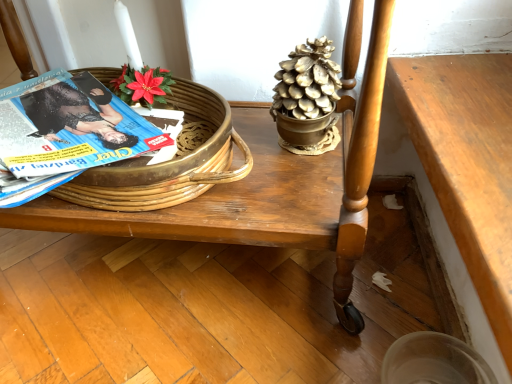
In order to face blue glossy magazine at left, should I rotate leftwards or rightwards?

Rotate left and turn 25.977 degrees.

This screenshot has height=384, width=512. Identify the location of woven wood basket at upper left. click(x=169, y=161).

Identify the location of gold metallic pinecone at upper center. (307, 97).

Is wooden table at center wider than gold metallic pinecone at upper center?

Yes, wooden table at center is wider than gold metallic pinecone at upper center.

Which is less distant, [349,262] or [325,45]?

Point [349,262] is closer to the camera than point [325,45].

Considering the sizes of wooden table at center and gold metallic pinecone at upper center in the image, is wooden table at center bigger or smaller than gold metallic pinecone at upper center?

wooden table at center is bigger than gold metallic pinecone at upper center.

From the image's perspective, would you say wooden table at center is shown under gold metallic pinecone at upper center?

Yes, from the image's perspective, wooden table at center is beneath gold metallic pinecone at upper center.

Would you say gold metallic pinecone at upper center is outside blue glossy magazine at left?

Indeed, gold metallic pinecone at upper center is completely outside blue glossy magazine at left.

Is gold metallic pinecone at upper center to the right of blue glossy magazine at left from the viewer's perspective?

Yes.

Is gold metallic pinecone at upper center wider than blue glossy magazine at left?

In fact, gold metallic pinecone at upper center might be narrower than blue glossy magazine at left.

Is gold metallic pinecone at upper center looking in the opposite direction of blue glossy magazine at left?

No, gold metallic pinecone at upper center is not facing the opposite direction of blue glossy magazine at left.

Does point (188, 96) come behind point (81, 124)?

Yes, it is behind point (81, 124).

Looking at this image, from a real-world perspective, is woven wood basket at upper left positioned under blue glossy magazine at left based on gravity?

Correct, in the physical world, woven wood basket at upper left is lower than blue glossy magazine at left.

Based on the photo, is woven wood basket at upper left bigger than blue glossy magazine at left?

Indeed, woven wood basket at upper left has a larger size compared to blue glossy magazine at left.

Does woven wood basket at upper left lie behind blue glossy magazine at left?

Yes, the depth of woven wood basket at upper left is greater than that of blue glossy magazine at left.

Are gold metallic pinecone at upper center and woven wood basket at upper left far apart?

No, there isn't a large distance between gold metallic pinecone at upper center and woven wood basket at upper left.

Is woven wood basket at upper left a part of gold metallic pinecone at upper center?

Definitely not — woven wood basket at upper left is not inside gold metallic pinecone at upper center.

Which of these two, gold metallic pinecone at upper center or woven wood basket at upper left, is wider?

woven wood basket at upper left is wider.

From a real-world perspective, is gold metallic pinecone at upper center physically located above or below woven wood basket at upper left?

gold metallic pinecone at upper center is above woven wood basket at upper left.

Is woven wood basket at upper left surrounded by blue glossy magazine at left?

No, woven wood basket at upper left is located outside of blue glossy magazine at left.

Does blue glossy magazine at left have a lesser width compared to woven wood basket at upper left?

No.

Considering the sizes of blue glossy magazine at left and woven wood basket at upper left in the image, is blue glossy magazine at left bigger or smaller than woven wood basket at upper left?

Clearly, blue glossy magazine at left is smaller in size than woven wood basket at upper left.

From the image's perspective, which is below, blue glossy magazine at left or woven wood basket at upper left?

From the image's view, woven wood basket at upper left is below.

From a real-world perspective, which is physically above, gold metallic pinecone at upper center or wooden table at center?

In real-world perspective, gold metallic pinecone at upper center is above.

Is wooden table at center completely or partially inside gold metallic pinecone at upper center?

No, wooden table at center is located outside of gold metallic pinecone at upper center.

Is gold metallic pinecone at upper center beside wooden table at center?

No, gold metallic pinecone at upper center is not next to wooden table at center.

Who is smaller, gold metallic pinecone at upper center or wooden table at center?

gold metallic pinecone at upper center.

From the image's perspective, is blue glossy magazine at left beneath gold metallic pinecone at upper center?

Correct, blue glossy magazine at left appears lower than gold metallic pinecone at upper center in the image.

Is blue glossy magazine at left to the left or to the right of gold metallic pinecone at upper center in the image?

Based on their positions, blue glossy magazine at left is located to the left of gold metallic pinecone at upper center.

The image size is (512, 384). Find the location of `houseplant that is above the blue glossy magazine at left (from a real-world perspective)`. houseplant that is above the blue glossy magazine at left (from a real-world perspective) is located at coordinates (307, 97).

Image resolution: width=512 pixels, height=384 pixels. What are the coordinates of `furniture beneath the gold metallic pinecone at upper center (from a real-world perspective)` in the screenshot? It's located at (208, 211).

Locate an element on the screen. magazine that is below the gold metallic pinecone at upper center (from the image's perspective) is located at coordinates (65, 133).

Consider the image. When comparing their distances from wooden table at lower right, does woven wood basket at upper left or wooden table at center seem closer?

Based on the image, wooden table at center appears to be nearer to wooden table at lower right.

When comparing their distances from wooden table at lower right, does wooden table at center or blue glossy magazine at left seem further?

Based on the image, blue glossy magazine at left appears to be further to wooden table at lower right.

Estimate the real-world distances between objects in this image. Which object is closer to woven wood basket at upper left, wooden table at lower right or gold metallic pinecone at upper center?

gold metallic pinecone at upper center is positioned closer to the anchor woven wood basket at upper left.

Based on their spatial positions, is woven wood basket at upper left or blue glossy magazine at left further from gold metallic pinecone at upper center?

The object further to gold metallic pinecone at upper center is blue glossy magazine at left.

Considering their positions, is wooden table at center positioned closer to gold metallic pinecone at upper center than woven wood basket at upper left?

wooden table at center is positioned closer to the anchor gold metallic pinecone at upper center.

Estimate the real-world distances between objects in this image. Which object is further from wooden table at lower right, gold metallic pinecone at upper center or blue glossy magazine at left?

The object further to wooden table at lower right is blue glossy magazine at left.

Based on the photo, looking at the image, which one is located closer to wooden table at center, blue glossy magazine at left or gold metallic pinecone at upper center?

Based on the image, gold metallic pinecone at upper center appears to be nearer to wooden table at center.

Consider the image. Considering their positions, is gold metallic pinecone at upper center positioned closer to wooden table at lower right than wooden table at center?

wooden table at center lies closer to wooden table at lower right than the other object.

This screenshot has width=512, height=384. I want to click on houseplant located between blue glossy magazine at left and wooden table at lower right in the left-right direction, so click(307, 97).

I want to click on furniture between blue glossy magazine at left and gold metallic pinecone at upper center from left to right, so (208, 211).

Where is `furniture between woven wood basket at upper left and gold metallic pinecone at upper center`? furniture between woven wood basket at upper left and gold metallic pinecone at upper center is located at coordinates (208, 211).

The image size is (512, 384). I want to click on furniture between blue glossy magazine at left and wooden table at lower right, so click(x=208, y=211).